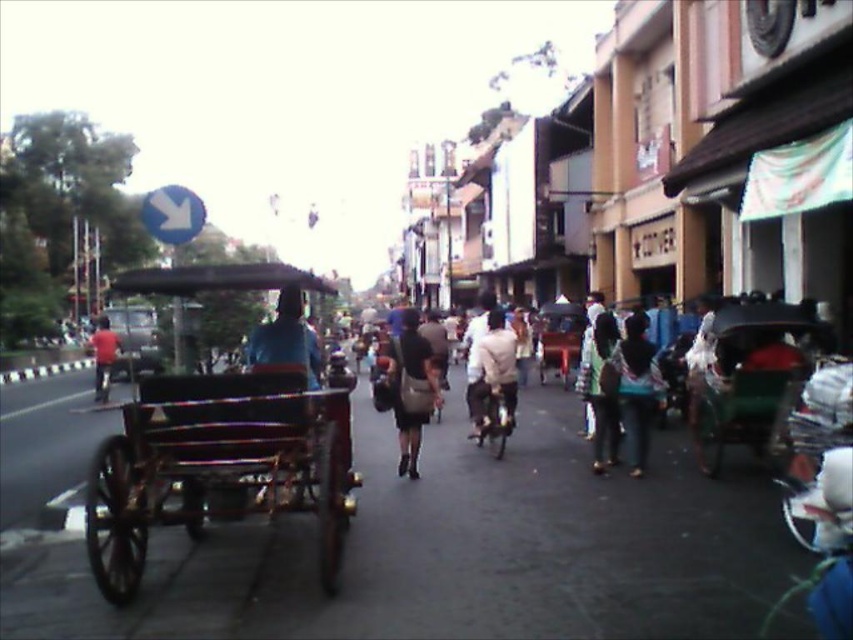
Question: Considering the real-world distances, which object is farthest from the patterned fabric scarf at center?

Choices:
 (A) matte black bag at center
 (B) red shirt at center

Answer: (B)

Question: Does light brown leather jacket at center have a smaller size compared to matte black bag at center?

Choices:
 (A) no
 (B) yes

Answer: (A)

Question: Does green wooden cart at right have a greater width compared to light brown leather jacket at center?

Choices:
 (A) yes
 (B) no

Answer: (A)

Question: Considering the real-world distances, which object is closest to the matte black bag at center?

Choices:
 (A) dark brown leather bag at center
 (B) blue fabric shirt at center

Answer: (A)

Question: Considering the relative positions of wooden wagon at left and green wooden cart at right in the image provided, where is wooden wagon at left located with respect to green wooden cart at right?

Choices:
 (A) left
 (B) right

Answer: (A)

Question: Estimate the real-world distances between objects in this image. Which object is farther from the patterned fabric scarf at center?

Choices:
 (A) green wooden cart at right
 (B) red shirt at center
 (C) blue fabric shirt at center

Answer: (B)